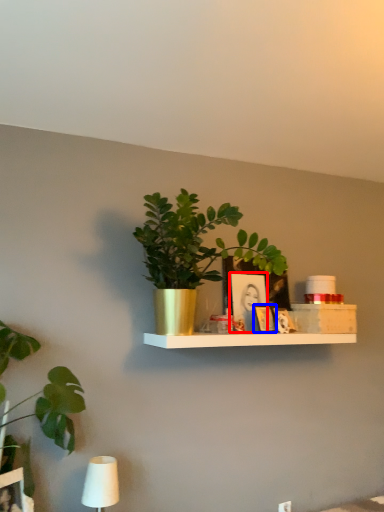
Question: Which of the following is the closest to the observer, picture frame (highlighted by a red box) or picture frame (highlighted by a blue box)?

Choices:
 (A) picture frame
 (B) picture frame

Answer: (B)